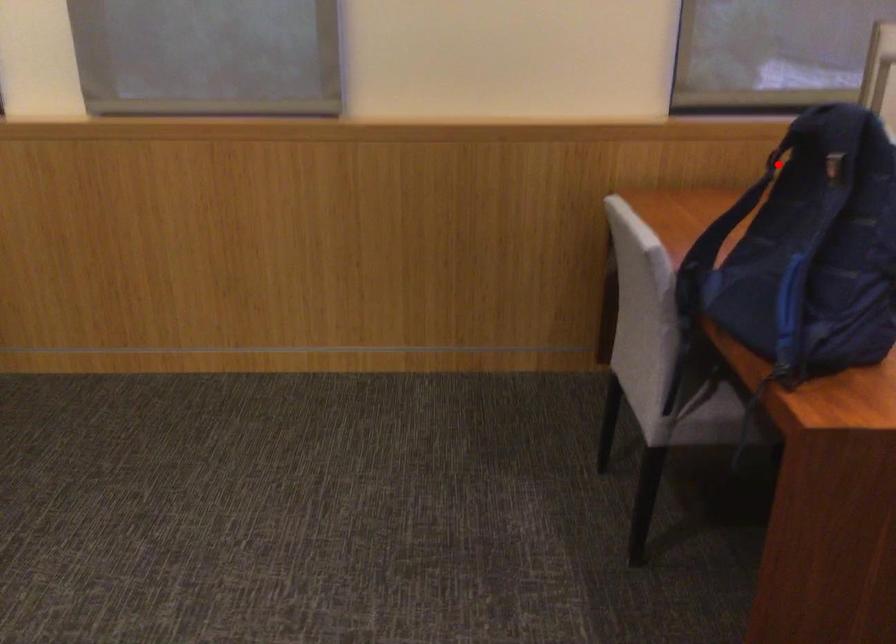
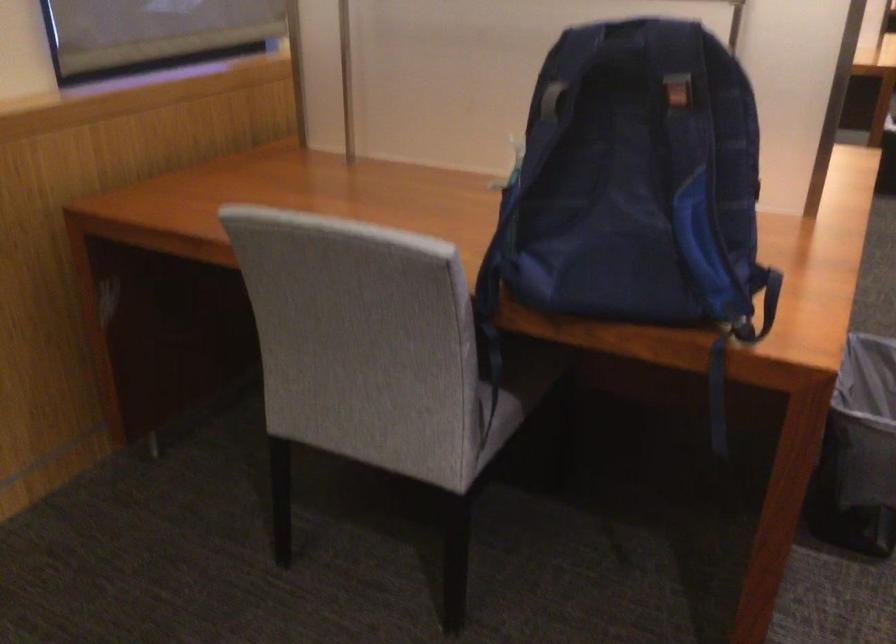
Question: I am providing you with two images of the same scene from different viewpoints. In image1, a red point is highlighted. Considering the same 3D point in image2, which of the following is correct?

Choices:
 (A) It is closer
 (B) It is farther

Answer: (A)